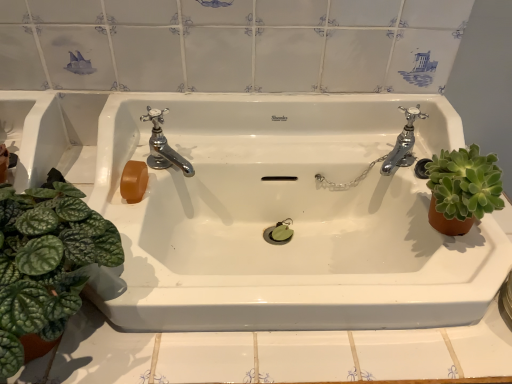
What is the approximate width of white glossy sink at center?

19.02 inches.

What are the coordinates of `chrome metallic faucet at upper left, arranged as the first tap when viewed from the left` in the screenshot? It's located at (163, 145).

Find the location of a particular element. green leafy plant at left, the 1th houseplant when ordered from left to right is located at coordinates (46, 262).

Which object is closer to the camera taking this photo, green succulent at right, placed as the second houseplant when sorted from left to right, or chrome metallic faucet at upper left, arranged as the first tap when viewed from the left?

green succulent at right, placed as the second houseplant when sorted from left to right.

Considering the relative sizes of green succulent at right, placed as the second houseplant when sorted from left to right, and chrome metallic faucet at upper left, marked as the second tap in a right-to-left arrangement, in the image provided, is green succulent at right, placed as the second houseplant when sorted from left to right, shorter than chrome metallic faucet at upper left, marked as the second tap in a right-to-left arrangement,?

No, green succulent at right, placed as the second houseplant when sorted from left to right, is not shorter than chrome metallic faucet at upper left, marked as the second tap in a right-to-left arrangement.

Does green succulent at right, which is the first houseplant from right to left, have a lesser width compared to chrome metallic faucet at upper left, marked as the second tap in a right-to-left arrangement?

Incorrect, the width of green succulent at right, which is the first houseplant from right to left, is not less than that of chrome metallic faucet at upper left, marked as the second tap in a right-to-left arrangement.

Identify the location of houseplant that is the 1st one when counting downward from the chrome metallic faucet at upper left, arranged as the first tap when viewed from the left (from the image's perspective). (462, 189).

Identify the location of houseplant located on the left of green succulent at right, which is the first houseplant from right to left. The height and width of the screenshot is (384, 512). (46, 262).

Considering the relative sizes of green leafy plant at left, arranged as the 2th houseplant when viewed from the right, and green succulent at right, placed as the second houseplant when sorted from left to right, in the image provided, is green leafy plant at left, arranged as the 2th houseplant when viewed from the right, bigger than green succulent at right, placed as the second houseplant when sorted from left to right,?

Correct, green leafy plant at left, arranged as the 2th houseplant when viewed from the right, is larger in size than green succulent at right, placed as the second houseplant when sorted from left to right.

Is green succulent at right, placed as the second houseplant when sorted from left to right, surrounded by green leafy plant at left, arranged as the 2th houseplant when viewed from the right?

No, green succulent at right, placed as the second houseplant when sorted from left to right, is not a part of green leafy plant at left, arranged as the 2th houseplant when viewed from the right.

Which of these two, green leafy plant at left, arranged as the 2th houseplant when viewed from the right, or green succulent at right, placed as the second houseplant when sorted from left to right, stands taller?

green leafy plant at left, arranged as the 2th houseplant when viewed from the right, is taller.

From the image's perspective, which object appears higher, chrome metallic faucet at right, which is counted as the first tap, starting from the right, or green leafy plant at left, arranged as the 2th houseplant when viewed from the right?

chrome metallic faucet at right, which is counted as the first tap, starting from the right, from the image's perspective.

Which object is further away from the camera taking this photo, chrome metallic faucet at right, which is counted as the first tap, starting from the right, or green leafy plant at left, arranged as the 2th houseplant when viewed from the right?

chrome metallic faucet at right, which is counted as the first tap, starting from the right, is more distant.

Who is shorter, chrome metallic faucet at right, which is counted as the first tap, starting from the right, or green leafy plant at left, the 1th houseplant when ordered from left to right?

chrome metallic faucet at right, which is counted as the first tap, starting from the right, is shorter.

Measure the distance from chrome metallic faucet at right, which is counted as the first tap, starting from the right, to green leafy plant at left, arranged as the 2th houseplant when viewed from the right.

The distance of chrome metallic faucet at right, which is counted as the first tap, starting from the right, from green leafy plant at left, arranged as the 2th houseplant when viewed from the right, is 24.09 inches.

Can you confirm if white glossy sink at center is positioned to the right of green leafy plant at left, arranged as the 2th houseplant when viewed from the right?

Yes.

Between point (300, 185) and point (34, 276), which one is positioned in front?

The point (34, 276) is closer to the camera.

Who is taller, white glossy sink at center or green leafy plant at left, arranged as the 2th houseplant when viewed from the right?

With more height is white glossy sink at center.

How different are the orientations of white glossy sink at center and green leafy plant at left, arranged as the 2th houseplant when viewed from the right, in degrees?

0.66 degrees separate the facing orientations of white glossy sink at center and green leafy plant at left, arranged as the 2th houseplant when viewed from the right.

Looking at their sizes, would you say chrome metallic faucet at upper left, arranged as the first tap when viewed from the left, is wider or thinner than white glossy sink at center?

Considering their sizes, chrome metallic faucet at upper left, arranged as the first tap when viewed from the left, looks slimmer than white glossy sink at center.

Which of these two, chrome metallic faucet at upper left, marked as the second tap in a right-to-left arrangement, or white glossy sink at center, is bigger?

white glossy sink at center.

Between chrome metallic faucet at upper left, marked as the second tap in a right-to-left arrangement, and white glossy sink at center, which one is positioned behind?

chrome metallic faucet at upper left, marked as the second tap in a right-to-left arrangement, is behind.

In terms of height, does chrome metallic faucet at upper left, marked as the second tap in a right-to-left arrangement, look taller or shorter compared to white glossy sink at center?

In the image, chrome metallic faucet at upper left, marked as the second tap in a right-to-left arrangement, appears to be shorter than white glossy sink at center.

Which object is further away from the camera taking this photo, green leafy plant at left, arranged as the 2th houseplant when viewed from the right, or chrome metallic faucet at upper left, arranged as the first tap when viewed from the left?

chrome metallic faucet at upper left, arranged as the first tap when viewed from the left, is more distant.

Between green leafy plant at left, the 1th houseplant when ordered from left to right, and chrome metallic faucet at upper left, marked as the second tap in a right-to-left arrangement, which one has larger width?

Wider between the two is green leafy plant at left, the 1th houseplant when ordered from left to right.

From the image's perspective, does green leafy plant at left, arranged as the 2th houseplant when viewed from the right, appear higher than chrome metallic faucet at upper left, arranged as the first tap when viewed from the left?

Incorrect, from the image's perspective, green leafy plant at left, arranged as the 2th houseplant when viewed from the right, is lower than chrome metallic faucet at upper left, arranged as the first tap when viewed from the left.

Is green leafy plant at left, the 1th houseplant when ordered from left to right, smaller than chrome metallic faucet at upper left, arranged as the first tap when viewed from the left?

No.

Is white glossy sink at center closer to the viewer compared to chrome metallic faucet at right, placed as the second tap when sorted from left to right?

Yes, white glossy sink at center is closer to the viewer.

I want to click on sink below the chrome metallic faucet at right, placed as the second tap when sorted from left to right (from the image's perspective), so click(285, 217).

Choose the correct answer: Is white glossy sink at center inside chrome metallic faucet at right, which is counted as the first tap, starting from the right, or outside it?

white glossy sink at center is located beyond the bounds of chrome metallic faucet at right, which is counted as the first tap, starting from the right.

From the image's perspective, is white glossy sink at center on chrome metallic faucet at right, placed as the second tap when sorted from left to right?

No.

There is a chrome metallic faucet at upper left, arranged as the first tap when viewed from the left. Where is `the 1st houseplant below it (from the image's perspective)`? The image size is (512, 384). the 1st houseplant below it (from the image's perspective) is located at coordinates (462, 189).

This screenshot has width=512, height=384. I want to click on houseplant that appears below the green leafy plant at left, arranged as the 2th houseplant when viewed from the right (from a real-world perspective), so click(462, 189).

When comparing their distances from white glossy sink at center, does green leafy plant at left, the 1th houseplant when ordered from left to right, or chrome metallic faucet at upper left, arranged as the first tap when viewed from the left, seem closer?

Among the two, chrome metallic faucet at upper left, arranged as the first tap when viewed from the left, is located nearer to white glossy sink at center.

When comparing their distances from green leafy plant at left, the 1th houseplant when ordered from left to right, does green succulent at right, which is the first houseplant from right to left, or white glossy sink at center seem closer?

Among the two, white glossy sink at center is located nearer to green leafy plant at left, the 1th houseplant when ordered from left to right.

Looking at the image, which one is located closer to green leafy plant at left, arranged as the 2th houseplant when viewed from the right, chrome metallic faucet at right, placed as the second tap when sorted from left to right, or green succulent at right, which is the first houseplant from right to left?

green succulent at right, which is the first houseplant from right to left, lies closer to green leafy plant at left, arranged as the 2th houseplant when viewed from the right, than the other object.

Looking at the image, which one is located further to green succulent at right, placed as the second houseplant when sorted from left to right, chrome metallic faucet at right, which is counted as the first tap, starting from the right, or green leafy plant at left, the 1th houseplant when ordered from left to right?

Based on the image, green leafy plant at left, the 1th houseplant when ordered from left to right, appears to be further to green succulent at right, placed as the second houseplant when sorted from left to right.

When comparing their distances from green leafy plant at left, the 1th houseplant when ordered from left to right, does chrome metallic faucet at right, which is counted as the first tap, starting from the right, or white glossy sink at center seem further?

chrome metallic faucet at right, which is counted as the first tap, starting from the right, is further to green leafy plant at left, the 1th houseplant when ordered from left to right.

When comparing their distances from chrome metallic faucet at right, placed as the second tap when sorted from left to right, does green leafy plant at left, the 1th houseplant when ordered from left to right, or white glossy sink at center seem further?

The object further to chrome metallic faucet at right, placed as the second tap when sorted from left to right, is green leafy plant at left, the 1th houseplant when ordered from left to right.

From the picture: From the image, which object appears to be farther from green leafy plant at left, the 1th houseplant when ordered from left to right, white glossy sink at center or chrome metallic faucet at upper left, marked as the second tap in a right-to-left arrangement?

white glossy sink at center is further to green leafy plant at left, the 1th houseplant when ordered from left to right.

Which object lies further to the anchor point chrome metallic faucet at upper left, marked as the second tap in a right-to-left arrangement, green leafy plant at left, the 1th houseplant when ordered from left to right, or green succulent at right, which is the first houseplant from right to left?

green succulent at right, which is the first houseplant from right to left, lies further to chrome metallic faucet at upper left, marked as the second tap in a right-to-left arrangement, than the other object.

I want to click on tap situated between chrome metallic faucet at upper left, arranged as the first tap when viewed from the left, and green succulent at right, which is the first houseplant from right to left, from left to right, so click(x=403, y=143).

The image size is (512, 384). I want to click on sink between green leafy plant at left, arranged as the 2th houseplant when viewed from the right, and chrome metallic faucet at right, which is counted as the first tap, starting from the right, from left to right, so click(285, 217).

Locate an element on the screen. This screenshot has width=512, height=384. sink situated between chrome metallic faucet at upper left, marked as the second tap in a right-to-left arrangement, and chrome metallic faucet at right, which is counted as the first tap, starting from the right, from left to right is located at coordinates (285, 217).

I want to click on sink located between green leafy plant at left, the 1th houseplant when ordered from left to right, and chrome metallic faucet at upper left, marked as the second tap in a right-to-left arrangement, in the depth direction, so click(285, 217).